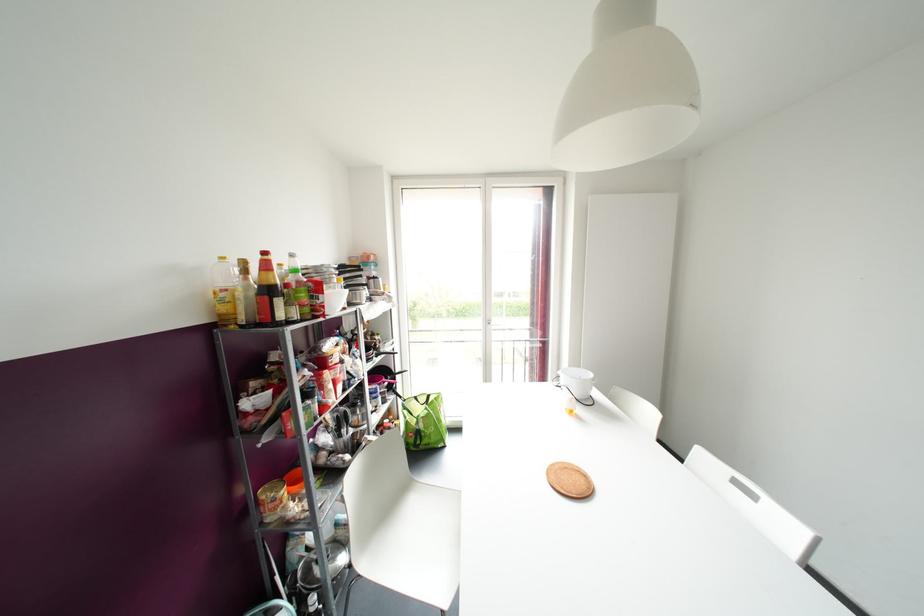
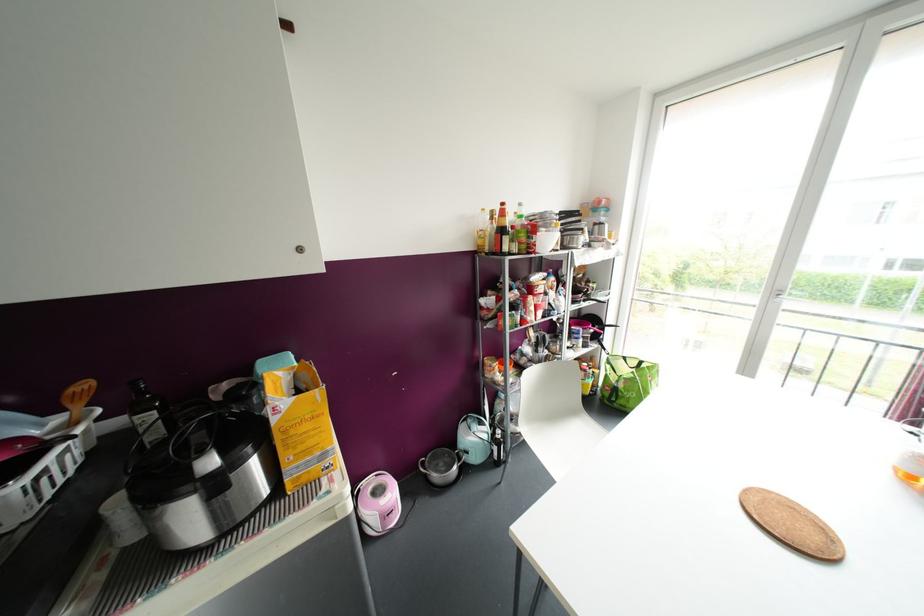
Where in the second image is the point corresponding to point 334,300 from the first image?

(546, 241)